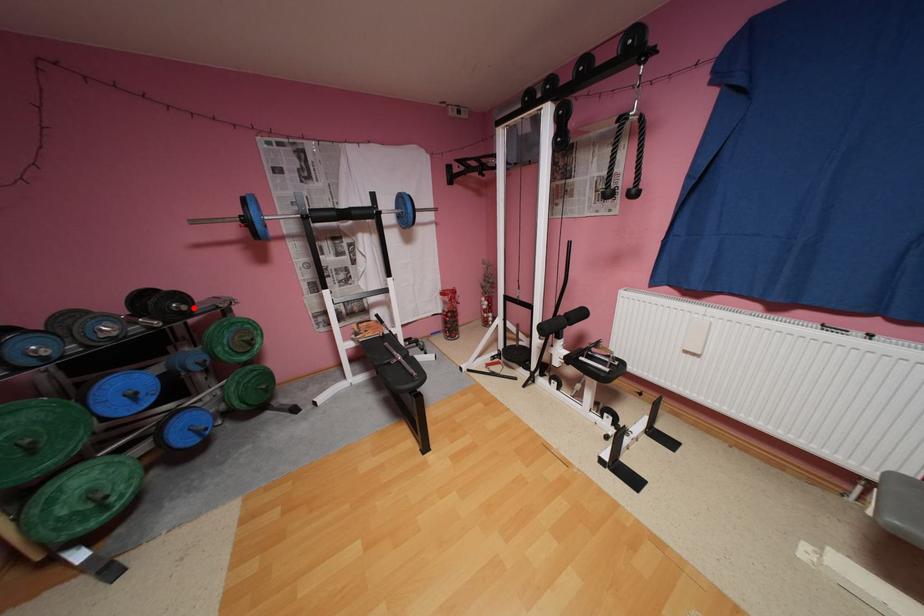
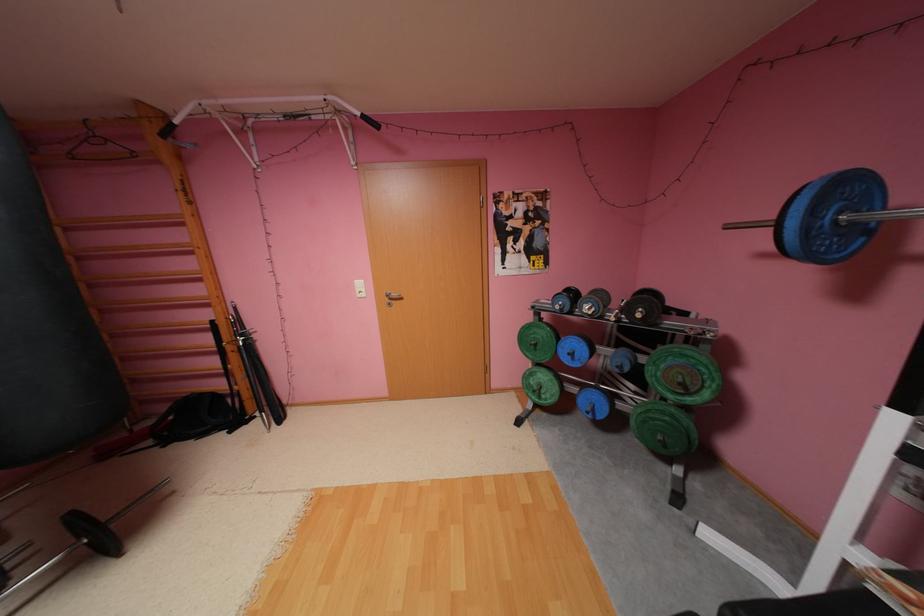
The point at the highlighted location is marked in the first image. Where is the corresponding point in the second image?

(648, 315)